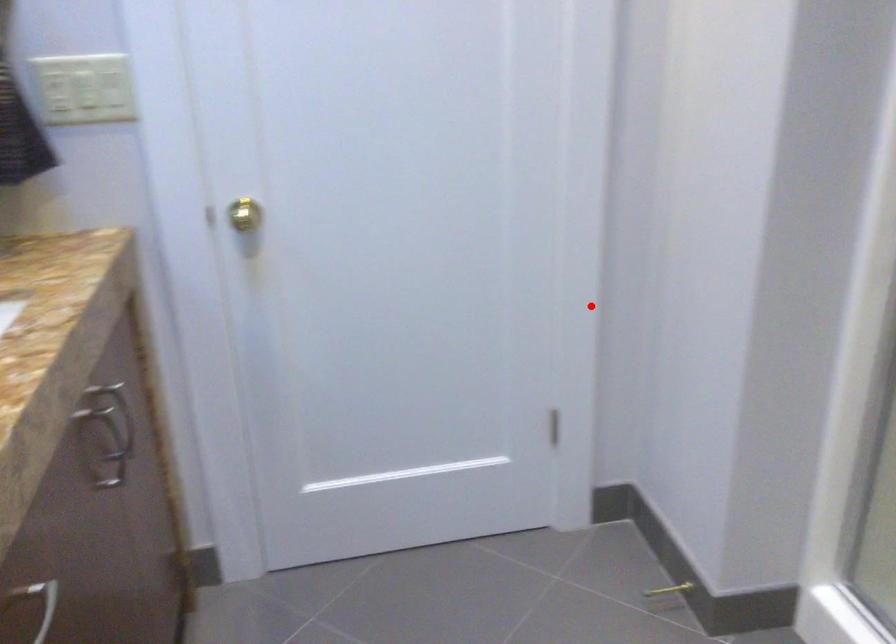
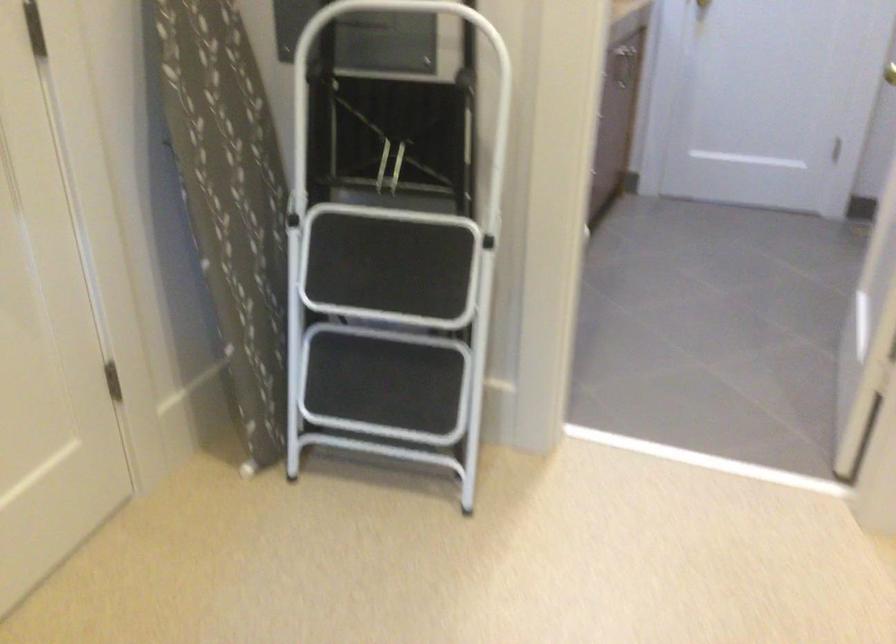
Find the pixel in the second image that matches the highlighted location in the first image.

(890, 73)